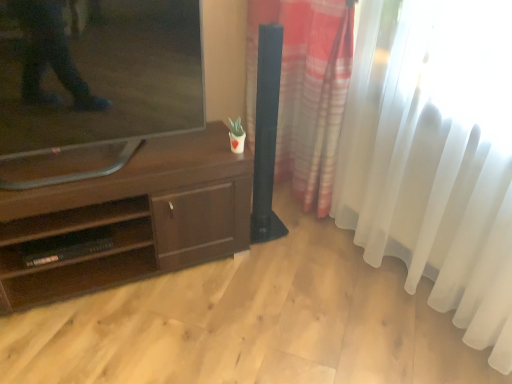
Question: Is black plastic shelf at lower left aimed at dark brown wood tv stand at center?

Choices:
 (A) yes
 (B) no

Answer: (A)

Question: From the image's perspective, is black plastic shelf at lower left over dark brown wood tv stand at center?

Choices:
 (A) no
 (B) yes

Answer: (A)

Question: Can we say black plastic shelf at lower left lies outside dark brown wood tv stand at center?

Choices:
 (A) yes
 (B) no

Answer: (B)

Question: Is black plastic shelf at lower left to the right of dark brown wood tv stand at center from the viewer's perspective?

Choices:
 (A) yes
 (B) no

Answer: (B)

Question: Is black plastic shelf at lower left turned away from dark brown wood tv stand at center?

Choices:
 (A) no
 (B) yes

Answer: (B)

Question: From a real-world perspective, is dark brown wood tv stand at center positioned above or below black plastic shelf at lower left?

Choices:
 (A) above
 (B) below

Answer: (A)

Question: In terms of height, does dark brown wood tv stand at center look taller or shorter compared to black plastic shelf at lower left?

Choices:
 (A) short
 (B) tall

Answer: (B)

Question: From the image's perspective, is dark brown wood tv stand at center positioned above or below black plastic shelf at lower left?

Choices:
 (A) above
 (B) below

Answer: (A)

Question: Considering the relative positions of dark brown wood tv stand at center and black plastic shelf at lower left in the image provided, is dark brown wood tv stand at center to the left or to the right of black plastic shelf at lower left?

Choices:
 (A) right
 (B) left

Answer: (A)

Question: From the image's perspective, is black plastic shelf at lower left above or below translucent fabric curtain at right?

Choices:
 (A) below
 (B) above

Answer: (A)

Question: Based on their sizes in the image, would you say black plastic shelf at lower left is bigger or smaller than translucent fabric curtain at right?

Choices:
 (A) big
 (B) small

Answer: (B)

Question: From a real-world perspective, is black plastic shelf at lower left physically located above or below translucent fabric curtain at right?

Choices:
 (A) above
 (B) below

Answer: (B)

Question: In the image, is black plastic shelf at lower left positioned in front of or behind translucent fabric curtain at right?

Choices:
 (A) front
 (B) behind

Answer: (B)

Question: From the image's perspective, is black plastic shelf at lower left above or below dark brown wood tv stand at center?

Choices:
 (A) below
 (B) above

Answer: (A)

Question: Is black plastic shelf at lower left to the left or to the right of dark brown wood tv stand at center in the image?

Choices:
 (A) right
 (B) left

Answer: (B)